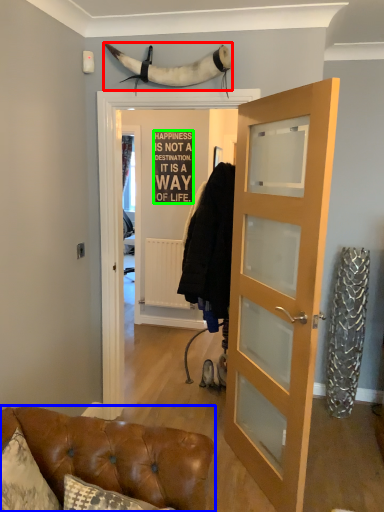
Question: Which is nearer to the animal (highlighted by a red box)? furniture (highlighted by a blue box) or writing (highlighted by a green box).

Choices:
 (A) furniture
 (B) writing

Answer: (A)